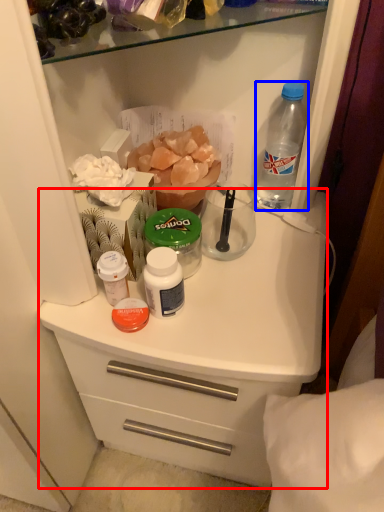
Question: Which point is closer to the camera, counter (highlighted by a red box) or bottle (highlighted by a blue box)?

Choices:
 (A) counter
 (B) bottle

Answer: (A)